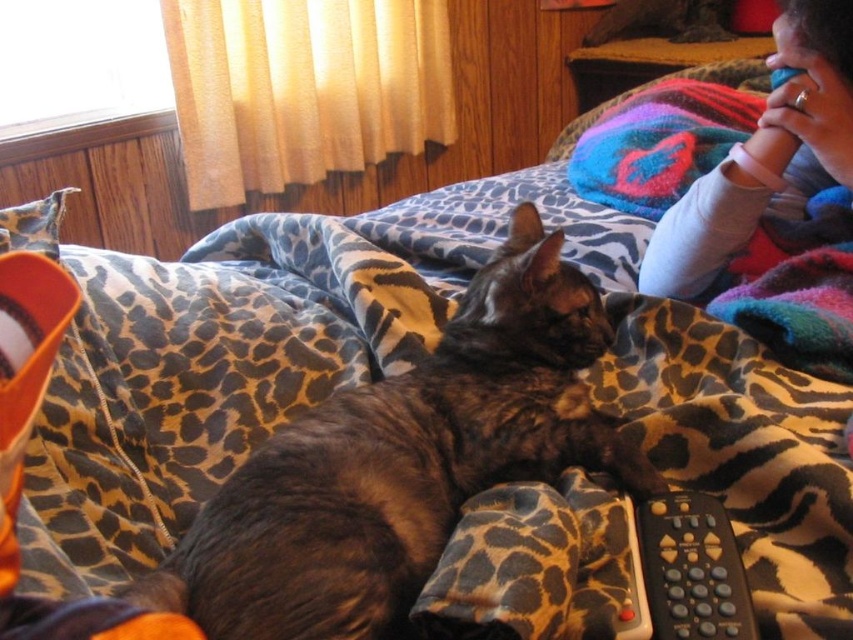
Does smooth pink baby rattle at upper right lie behind black plastic remote at lower right?

Yes, it is.

Can you confirm if smooth pink baby rattle at upper right is bigger than black plastic remote at lower right?

Yes.

Is point (793, 3) in front of point (698, 577)?

No, it is behind (698, 577).

At what (x,y) coordinates should I click in order to perform the action: click on smooth pink baby rattle at upper right. Please return your answer as a coordinate pair (x, y). This screenshot has width=853, height=640. Looking at the image, I should click on (764, 156).

Between brown fur cat at center and black plastic remote at lower right, which one is positioned higher?

brown fur cat at center is higher up.

The image size is (853, 640). I want to click on brown fur cat at center, so click(404, 461).

Does brown fur cat at center have a smaller size compared to smooth pink baby rattle at upper right?

Actually, brown fur cat at center might be larger than smooth pink baby rattle at upper right.

Between point (432, 429) and point (848, 92), which one is positioned in front?

Point (432, 429) is in front.

Between point (527, 234) and point (834, 84), which one is positioned in front?

Point (834, 84) is more forward.

Identify the location of brown fur cat at center. This screenshot has width=853, height=640. [404, 461].